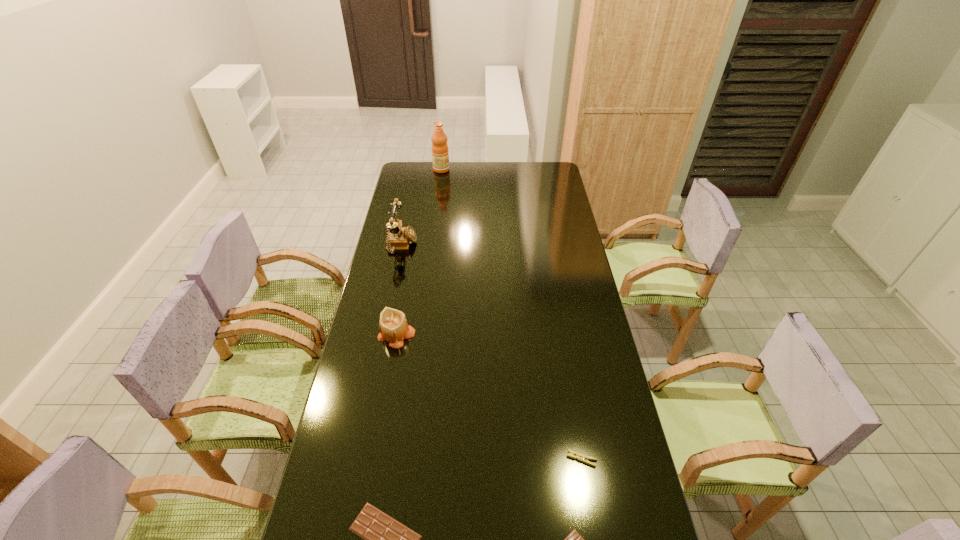
The height and width of the screenshot is (540, 960). What are the coordinates of `vacant area in the image that satisfies the following two spatial constraints: 1. on the label side of the fruit juice; 2. on the front side of the fourth shortest object` in the screenshot? It's located at (420, 336).